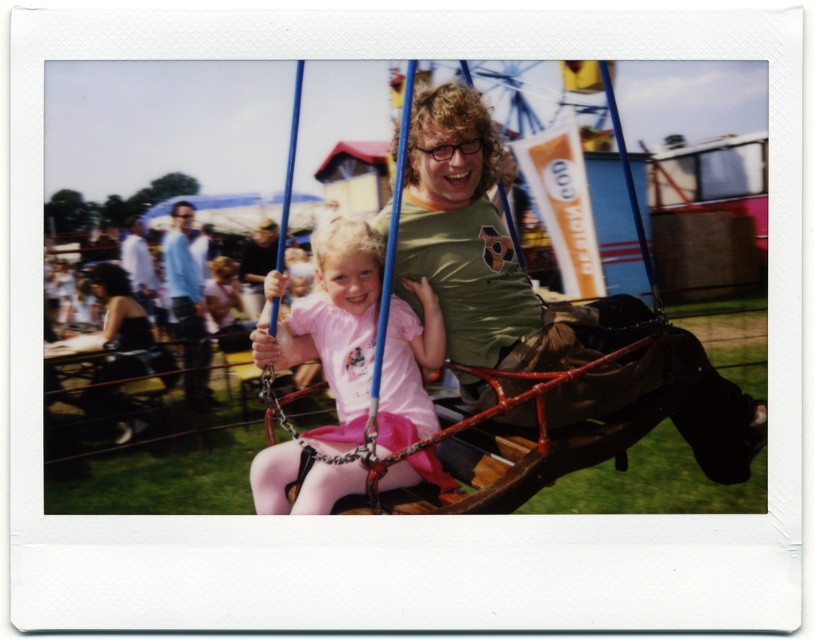
You are a photographer at the fair and want to take a picture of the pink fabric dress at center and the wooden swing at center. Which object is shorter in height?

The pink fabric dress at center is not as tall as the wooden swing at center, so the pink fabric dress at center is shorter in height.

You are standing at the center of the carousel and want to hand a balloon to the person closest to you. Which point should you target? The point at the center of the carousel is at coordinate point 0.5, 0.5. The two points are point (290,444) and point (180,269). Remember, the person closest to you would be the one with the smaller distance from the center.

Point (290,444) is closer to the center of the carousel at 0.5, 0.5 than point (180,269). Therefore, you should target point (290,444) to hand the balloon to the person closest to you.